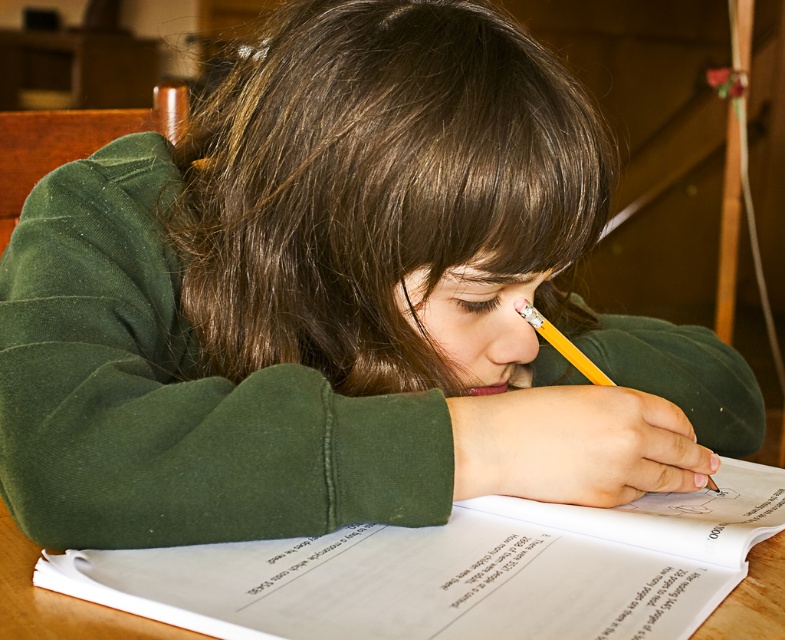
Question: Can you confirm if wooden table at center is positioned to the left of white paper at lower center?

Choices:
 (A) yes
 (B) no

Answer: (B)

Question: Which of the following is the closest to the observer?

Choices:
 (A) (608, 380)
 (B) (628, 579)
 (C) (479, 566)

Answer: (B)

Question: Considering the relative positions of white paper at lower center and yellow wood pencil at upper center in the image provided, where is white paper at lower center located with respect to yellow wood pencil at upper center?

Choices:
 (A) below
 (B) above

Answer: (A)

Question: Which object is closer to the camera taking this photo?

Choices:
 (A) yellow wood pencil at upper center
 (B) wooden table at center
 (C) white paper at lower center

Answer: (B)

Question: Based on their relative distances, which object is farther from the yellow wood pencil at upper center?

Choices:
 (A) wooden table at center
 (B) white paper at lower center

Answer: (A)

Question: Is wooden table at center bigger than yellow wood pencil at upper center?

Choices:
 (A) yes
 (B) no

Answer: (A)